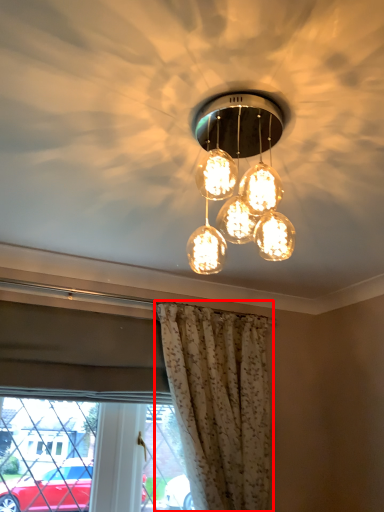
Question: Considering the relative positions of curtain (annotated by the red box) and lamp in the image provided, where is curtain (annotated by the red box) located with respect to the staircase?

Choices:
 (A) left
 (B) right

Answer: (B)